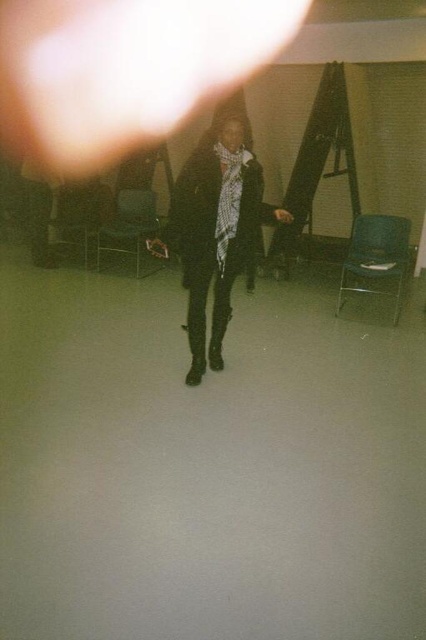
From the picture: How distant is metallic silver chair at left from metallic blue chair at center?

metallic silver chair at left and metallic blue chair at center are 7.47 feet apart from each other.

Looking at this image, between metallic silver chair at left and metallic blue chair at center, which one appears on the left side from the viewer's perspective?

metallic silver chair at left is more to the left.

Where is `metallic silver chair at left`? The image size is (426, 640). metallic silver chair at left is located at coordinates (77, 212).

Based on the photo, who is more forward, (112, 227) or (85, 256)?

Point (112, 227)

Between point (108, 227) and point (98, 192), which one is positioned in front?

Positioned in front is point (108, 227).

Image resolution: width=426 pixels, height=640 pixels. Identify the location of metallic silver chair at center. (129, 225).

This screenshot has height=640, width=426. What do you see at coordinates (376, 259) in the screenshot?
I see `metallic blue chair at right` at bounding box center [376, 259].

From the picture: Does metallic blue chair at right come in front of metallic blue chair at center?

Yes, metallic blue chair at right is in front of metallic blue chair at center.

Image resolution: width=426 pixels, height=640 pixels. Identify the location of metallic blue chair at right. (376, 259).

The image size is (426, 640). What are the coordinates of `metallic blue chair at right` in the screenshot? It's located at pos(376,259).